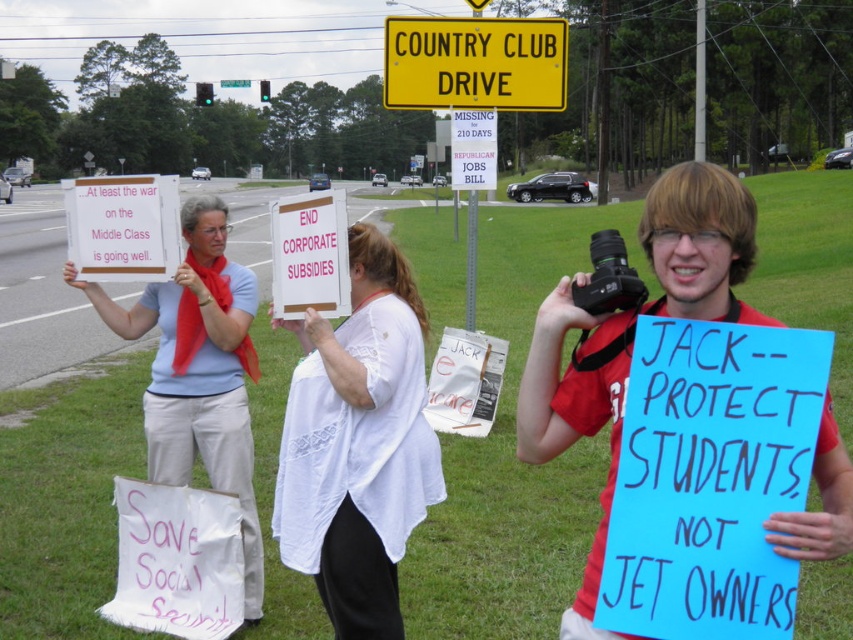
Question: Which object is the farthest from the light blue shirt at center?

Choices:
 (A) matte red shirt at center
 (B) pink paper sign at center
 (C) white lace shirt at center
 (D) yellowmaterial/texturesign at upper center

Answer: (D)

Question: Where is pink paper sign at center located in relation to yellowmaterial/texturesign at upper center in the image?

Choices:
 (A) right
 (B) left

Answer: (A)

Question: Which of these objects is positioned closest to the yellowmaterial/texturesign at upper center?

Choices:
 (A) matte red shirt at center
 (B) white lace shirt at center
 (C) light blue shirt at center
 (D) pink paper sign at center

Answer: (C)

Question: Is light blue shirt at center in front of yellow plastic sign at upper center?

Choices:
 (A) no
 (B) yes

Answer: (B)

Question: Does matte red shirt at center lie in front of pink paper sign at center?

Choices:
 (A) yes
 (B) no

Answer: (A)

Question: Which object is closer to the camera taking this photo?

Choices:
 (A) yellow plastic sign at upper center
 (B) light blue shirt at center
 (C) yellowmaterial/texturesign at upper center

Answer: (B)